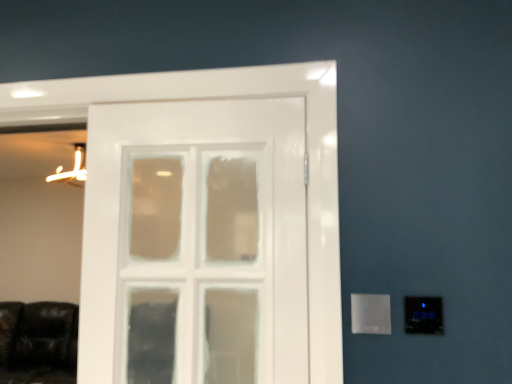
This screenshot has height=384, width=512. What do you see at coordinates (370, 314) in the screenshot? I see `satin silver square at lower right` at bounding box center [370, 314].

I want to click on satin silver square at lower right, so click(370, 314).

Where is `satin silver square at lower right`? satin silver square at lower right is located at coordinates (370, 314).